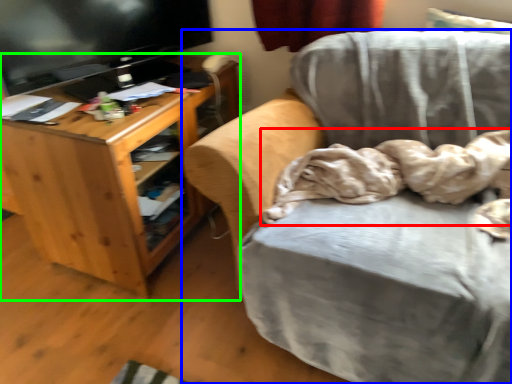
Question: Considering the real-world distances, which object is farthest from blanket (highlighted by a red box)? chair (highlighted by a blue box) or desk (highlighted by a green box)?

Choices:
 (A) chair
 (B) desk

Answer: (B)